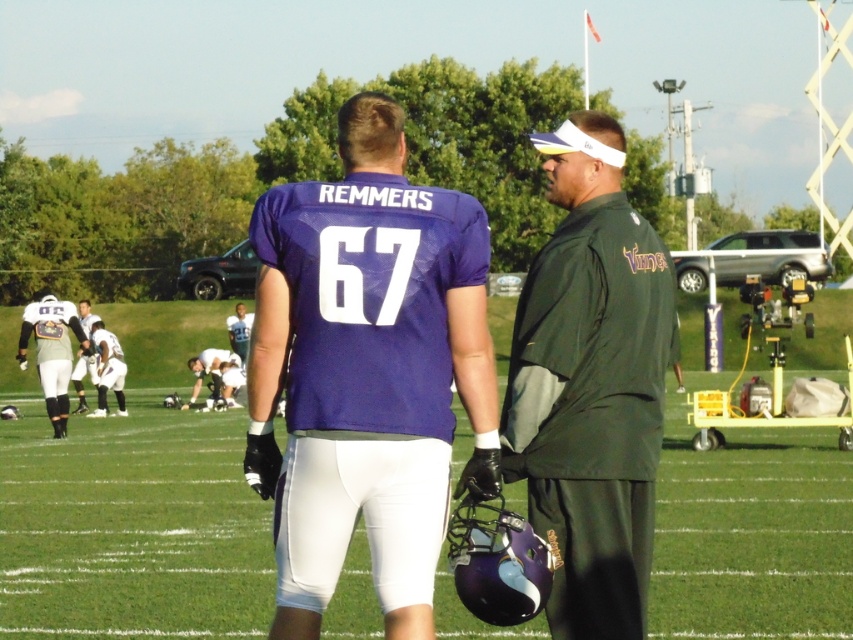
Consider the image. How much distance is there between green fabric jacket at right and silver metallic helmet at lower left?

18.13 meters

Is green fabric jacket at right positioned in front of silver metallic helmet at lower left?

Yes, green fabric jacket at right is in front of silver metallic helmet at lower left.

Does point (578, 404) lie in front of point (38, 320)?

That is True.

Find the location of `green fabric jacket at right`. green fabric jacket at right is located at coordinates click(x=590, y=397).

Does green artificial turf at center have a greater height compared to white uniform at lower left?

Yes.

Does green artificial turf at center appear under white uniform at lower left?

No, green artificial turf at center is not below white uniform at lower left.

What do you see at coordinates (131, 500) in the screenshot? The width and height of the screenshot is (853, 640). I see `green artificial turf at center` at bounding box center [131, 500].

You are a GUI agent. You are given a task and a screenshot of the screen. Output one action in this format:
    pyautogui.click(x=<x>, y=<y>)
    Task: Click on the green artificial turf at center
    This screenshot has height=640, width=853.
    Given the screenshot: What is the action you would take?
    pyautogui.click(x=131, y=500)

Does green fabric jacket at right have a greater height compared to white uniform at left?

No.

I want to click on green fabric jacket at right, so click(590, 397).